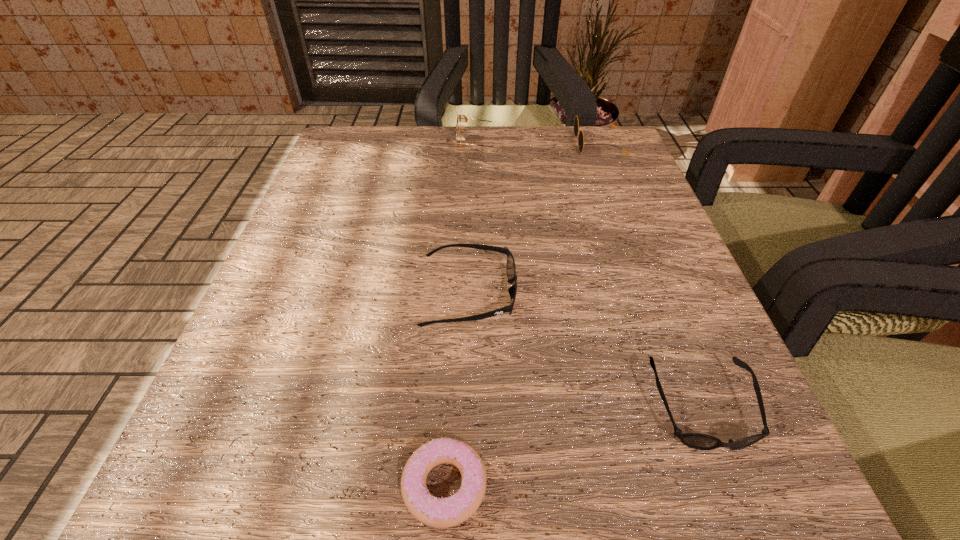
I want to click on free point that satisfies the following two spatial constraints: 1. on the front-facing side of the third nearest object; 2. on the front side of the doughnut, so click(465, 485).